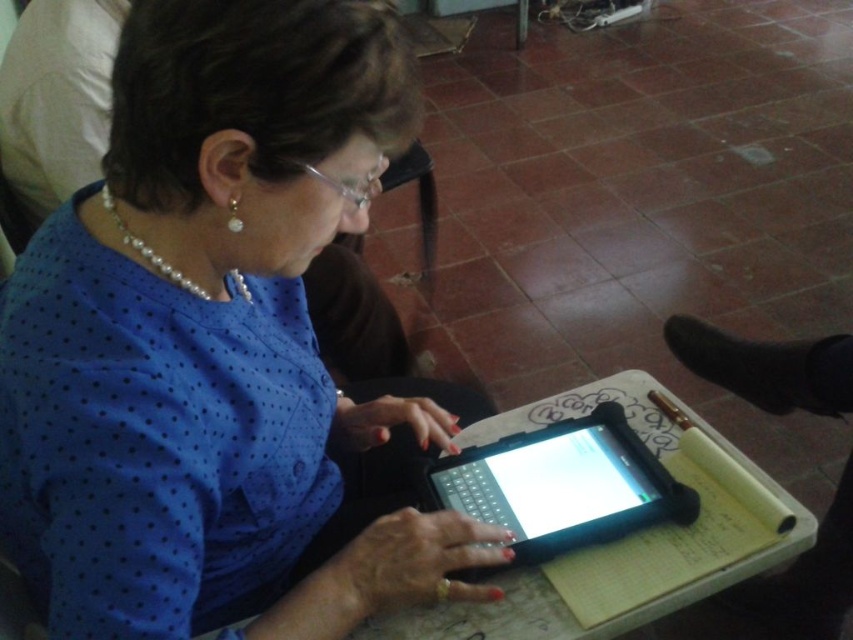
Question: Does blue dotted shirt at center have a lesser width compared to white paper at center?

Choices:
 (A) yes
 (B) no

Answer: (A)

Question: Is blue dotted shirt at center bigger than white paper at center?

Choices:
 (A) no
 (B) yes

Answer: (B)

Question: Which point is farther to the camera?

Choices:
 (A) blue dotted shirt at center
 (B) black rubberized tablet at center

Answer: (B)

Question: Does black rubberized tablet at center have a greater width compared to white paper at center?

Choices:
 (A) yes
 (B) no

Answer: (B)

Question: Which object is closer to the camera taking this photo?

Choices:
 (A) blue dotted shirt at center
 (B) white paper at center
 (C) black rubberized tablet at center

Answer: (A)

Question: Which point appears farthest from the camera in this image?

Choices:
 (A) (456, 538)
 (B) (506, 620)

Answer: (B)